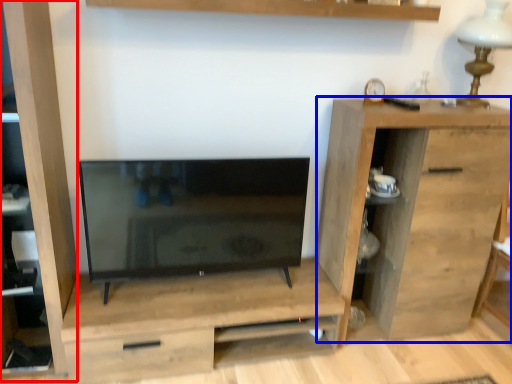
Question: Among these objects, which one is nearest to the camera, cabinet (highlighted by a red box) or chest of drawers (highlighted by a blue box)?

Choices:
 (A) cabinet
 (B) chest of drawers

Answer: (A)